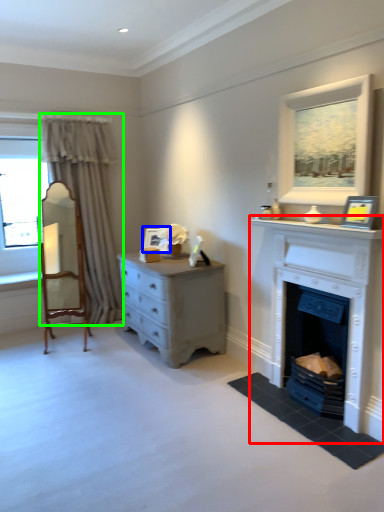
Question: Based on their relative distances, which object is farther from fireplace (highlighted by a red box)? Choose from picture frame (highlighted by a blue box) and curtain (highlighted by a green box).

Choices:
 (A) picture frame
 (B) curtain

Answer: (B)